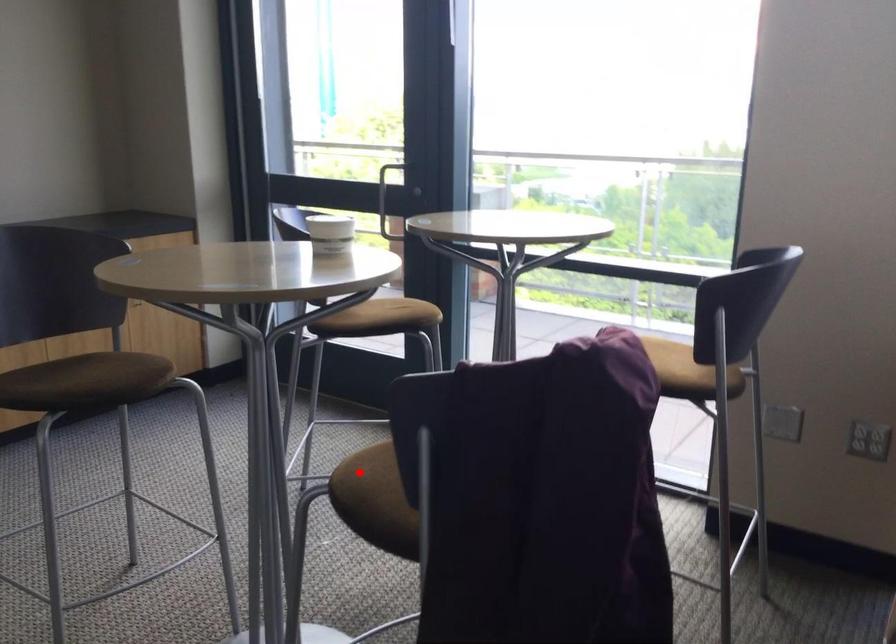
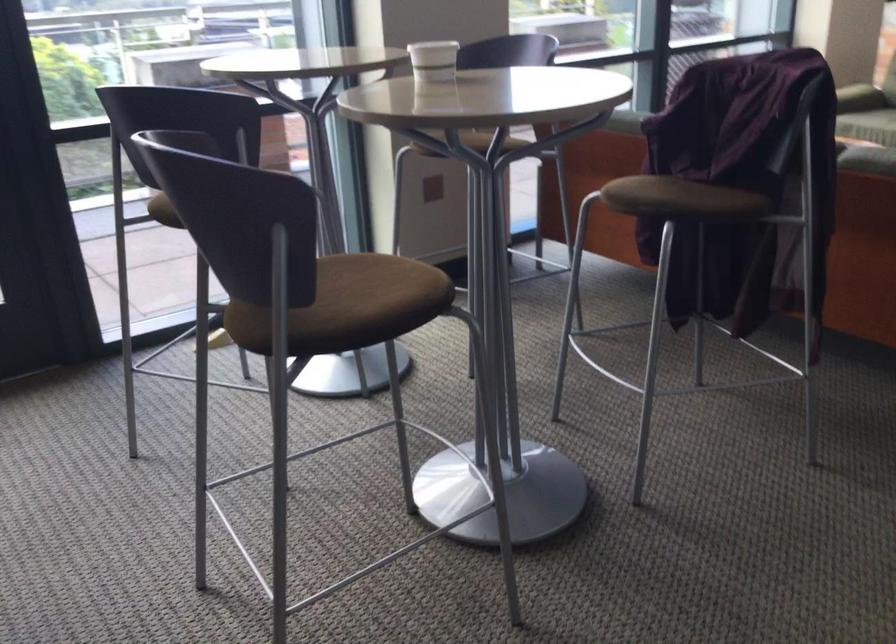
The point at the highlighted location is marked in the first image. Where is the corresponding point in the second image?

(666, 198)